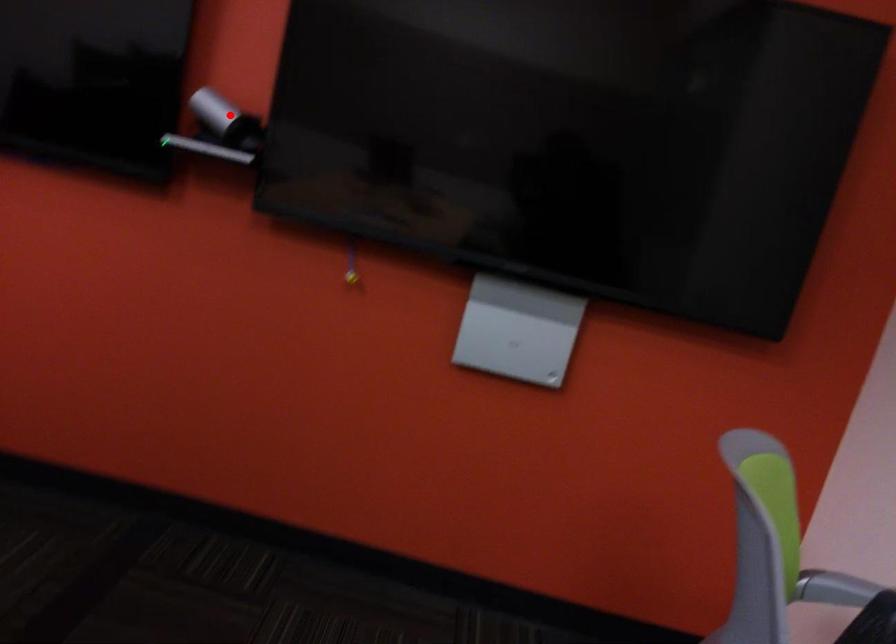
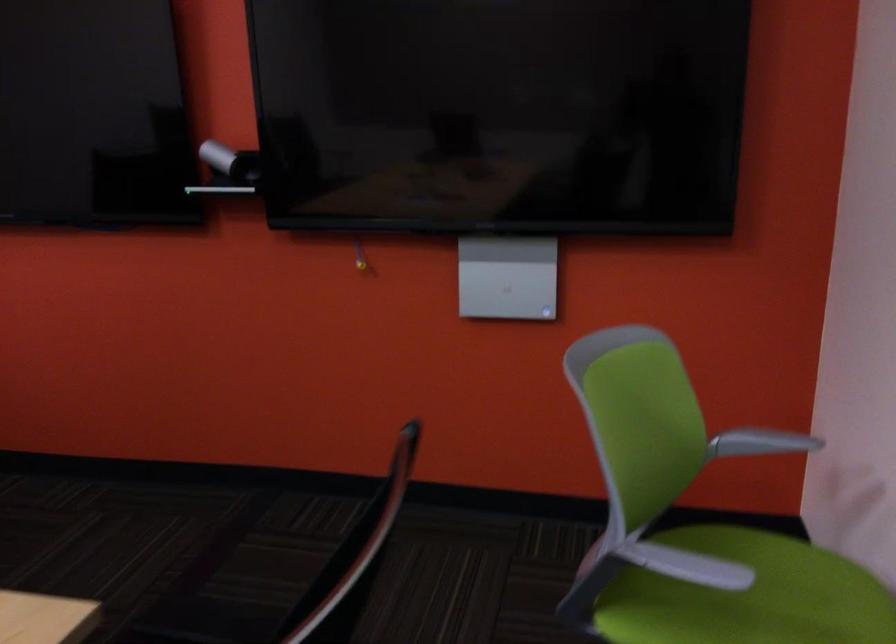
The point at the highlighted location is marked in the first image. Where is the corresponding point in the second image?

(230, 162)